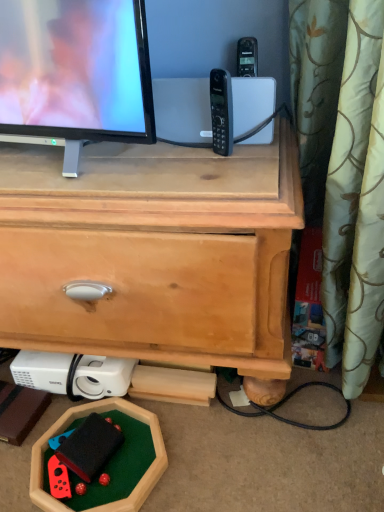
Question: Is black plastic phone at center to the left of rubberized red game controller at lower left from the viewer's perspective?

Choices:
 (A) no
 (B) yes

Answer: (A)

Question: Could you tell me if black plastic phone at center is turned towards rubberized red game controller at lower left?

Choices:
 (A) yes
 (B) no

Answer: (B)

Question: Is black plastic phone at center located outside rubberized red game controller at lower left?

Choices:
 (A) no
 (B) yes

Answer: (B)

Question: Is black plastic phone at center bigger than rubberized red game controller at lower left?

Choices:
 (A) no
 (B) yes

Answer: (A)

Question: From the image's perspective, is black plastic phone at center located beneath rubberized red game controller at lower left?

Choices:
 (A) yes
 (B) no

Answer: (B)

Question: In the image, is light brown wood chest of drawers at center positioned in front of or behind black plastic phone at center?

Choices:
 (A) behind
 (B) front

Answer: (B)

Question: Does point (244, 285) appear closer or farther from the camera than point (213, 129)?

Choices:
 (A) farther
 (B) closer

Answer: (B)

Question: Looking at their shapes, would you say light brown wood chest of drawers at center is wider or thinner than black plastic phone at center?

Choices:
 (A) thin
 (B) wide

Answer: (B)

Question: In the image, is light brown wood chest of drawers at center on the left side or the right side of black plastic phone at center?

Choices:
 (A) right
 (B) left

Answer: (B)

Question: Based on their positions, is light brown wood chest of drawers at center located to the left or right of rubberized red game controller at lower left?

Choices:
 (A) left
 (B) right

Answer: (A)

Question: In terms of height, does light brown wood chest of drawers at center look taller or shorter compared to rubberized red game controller at lower left?

Choices:
 (A) short
 (B) tall

Answer: (B)

Question: From a real-world perspective, is light brown wood chest of drawers at center physically located above or below rubberized red game controller at lower left?

Choices:
 (A) above
 (B) below

Answer: (A)

Question: From the image's perspective, is light brown wood chest of drawers at center positioned above or below rubberized red game controller at lower left?

Choices:
 (A) above
 (B) below

Answer: (A)

Question: Based on their positions, is rubberized red game controller at lower left located to the left or right of light brown wood chest of drawers at center?

Choices:
 (A) right
 (B) left

Answer: (A)

Question: Is rubberized red game controller at lower left bigger or smaller than light brown wood chest of drawers at center?

Choices:
 (A) big
 (B) small

Answer: (B)